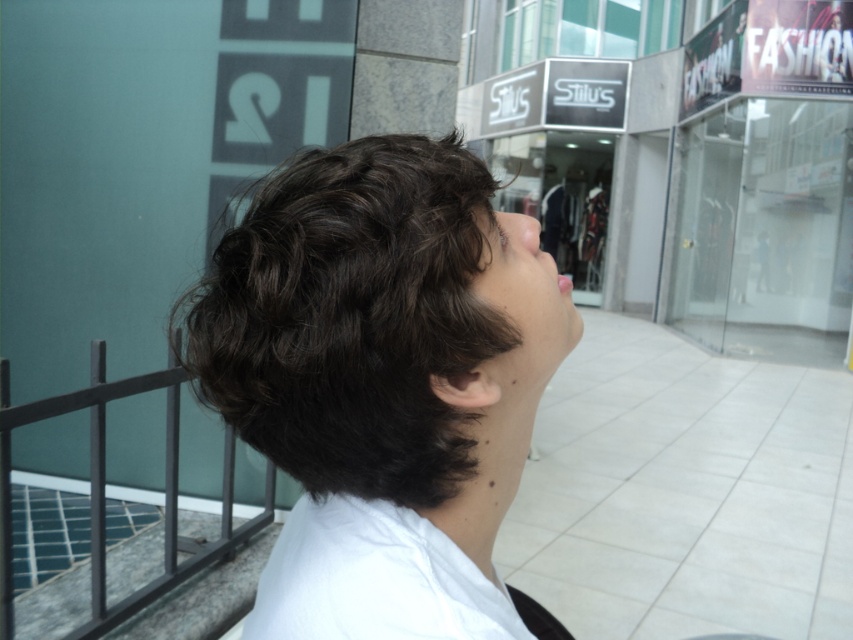
Is white cotton shirt at center shorter than smooth skin face at center?

Yes, white cotton shirt at center is shorter than smooth skin face at center.

Image resolution: width=853 pixels, height=640 pixels. Find the location of `white cotton shirt at center`. white cotton shirt at center is located at coordinates (374, 579).

Is point (99, 602) closer to camera compared to point (535, 236)?

That is False.

In the scene shown: Does black metal balustrade at lower left appear under smooth skin face at center?

Indeed, black metal balustrade at lower left is positioned under smooth skin face at center.

Find the location of `black metal balustrade at lower left`. black metal balustrade at lower left is located at coordinates (103, 484).

Where is `black metal balustrade at lower left`? This screenshot has height=640, width=853. black metal balustrade at lower left is located at coordinates (103, 484).

Between dark curly hair at center and smooth skin face at center, which one appears on the right side from the viewer's perspective?

smooth skin face at center is more to the right.

Does dark curly hair at center appear on the right side of smooth skin face at center?

No, dark curly hair at center is not to the right of smooth skin face at center.

Which is behind, point (341, 412) or point (490, 305)?

Positioned behind is point (341, 412).

Find the location of a particular element. The width and height of the screenshot is (853, 640). dark curly hair at center is located at coordinates (352, 317).